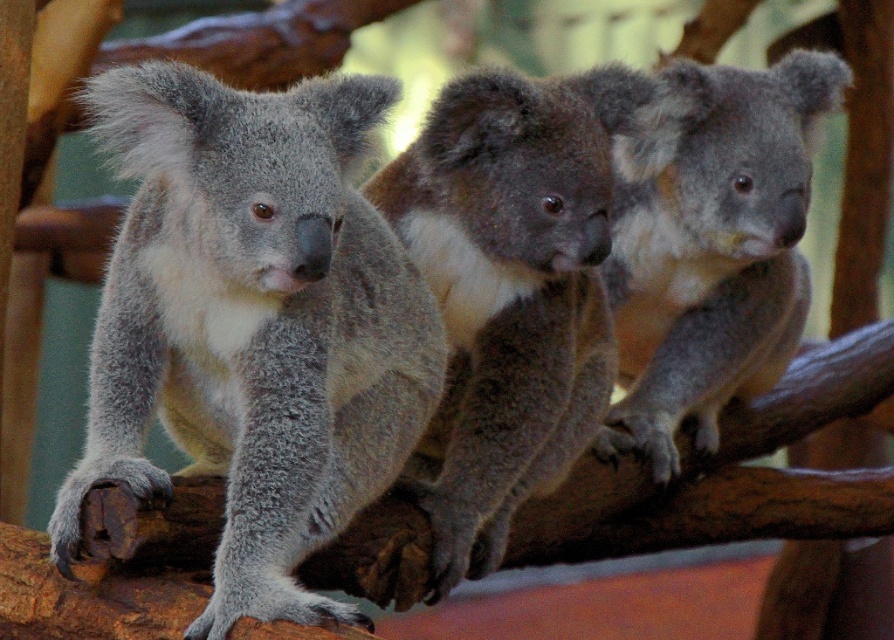
Describe the element at coordinates (252, 323) in the screenshot. I see `gray fluffy koala at left` at that location.

Does gray fluffy koala at left have a lesser width compared to gray furry koala at center?

In fact, gray fluffy koala at left might be wider than gray furry koala at center.

What do you see at coordinates (252, 323) in the screenshot?
I see `gray fluffy koala at left` at bounding box center [252, 323].

Locate an element on the screen. gray fluffy koala at left is located at coordinates (252, 323).

Describe the element at coordinates (252, 323) in the screenshot. The height and width of the screenshot is (640, 894). I see `gray fluffy koala at left` at that location.

Locate an element on the screen. The image size is (894, 640). gray fluffy koala at left is located at coordinates (252, 323).

Where is `gray fluffy koala at left`? gray fluffy koala at left is located at coordinates (252, 323).

Can you confirm if fuzzy gray koala at center is thinner than gray furry koala at center?

No, fuzzy gray koala at center is not thinner than gray furry koala at center.

In the scene shown: Does fuzzy gray koala at center appear under gray furry koala at center?

Yes.

Which is in front, point (545, 460) or point (685, 216)?

Point (545, 460) is in front.

Find the location of `fuzzy gray koala at center`. fuzzy gray koala at center is located at coordinates (510, 289).